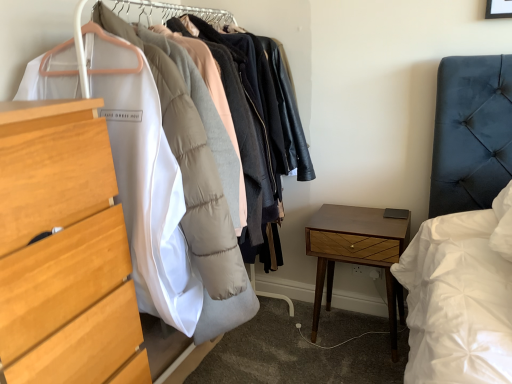
I want to click on free point to the left of wooden nightstand at lower right, so click(x=293, y=331).